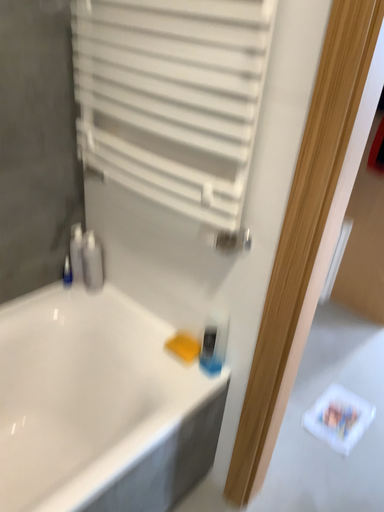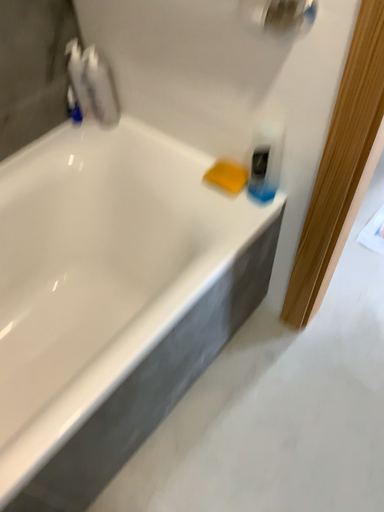
Question: Which way did the camera rotate in the video?

Choices:
 (A) rotated downward
 (B) rotated upward

Answer: (A)